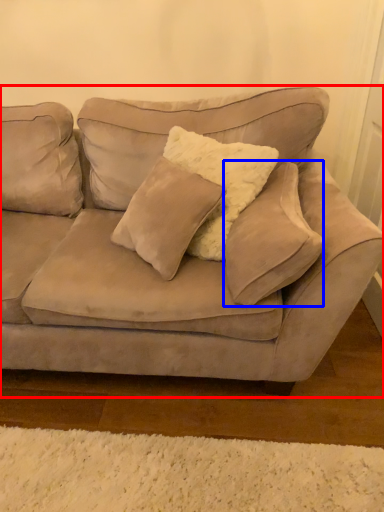
Question: Among these objects, which one is nearest to the camera, studio couch (highlighted by a red box) or pillow (highlighted by a blue box)?

Choices:
 (A) studio couch
 (B) pillow

Answer: (A)